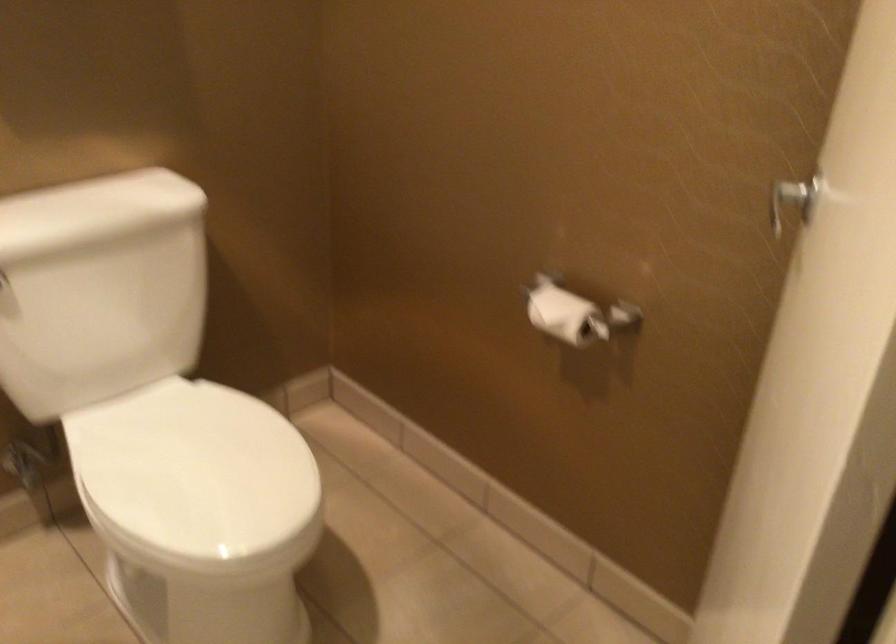
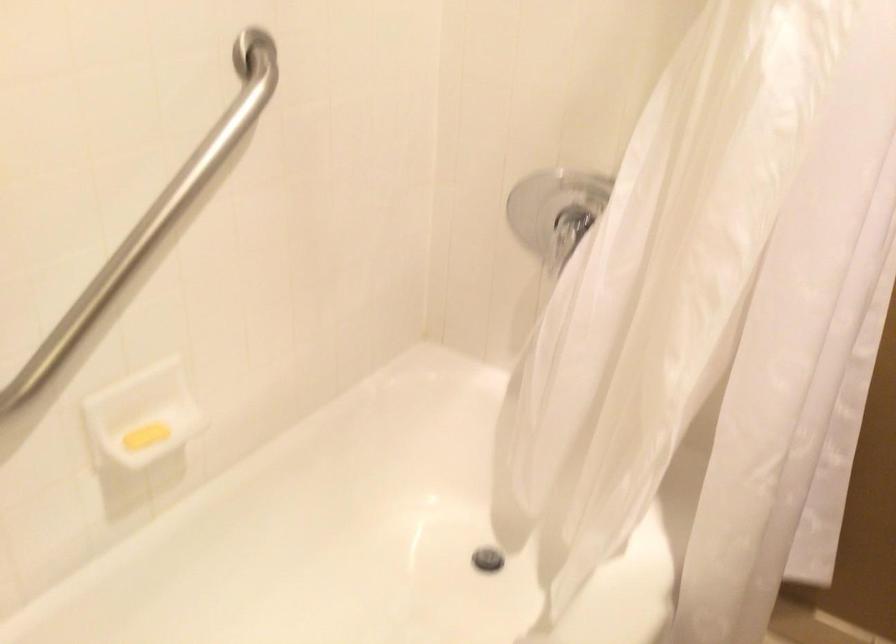
The images are taken continuously from a first-person perspective. In which direction is your viewpoint rotating?

The rotation direction of the camera is left-down.